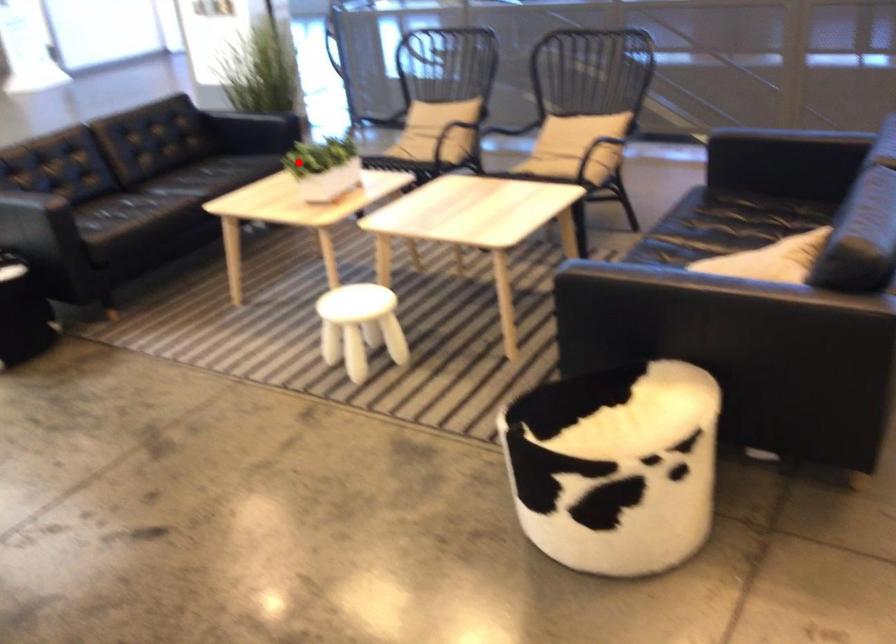
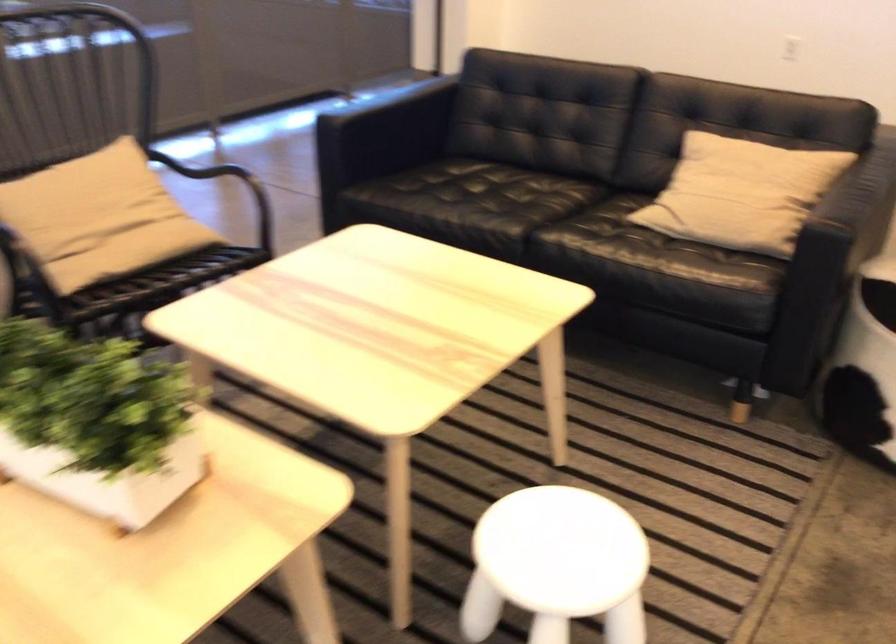
Where in the second image is the point corresponding to the highlighted location from the first image?

(96, 422)